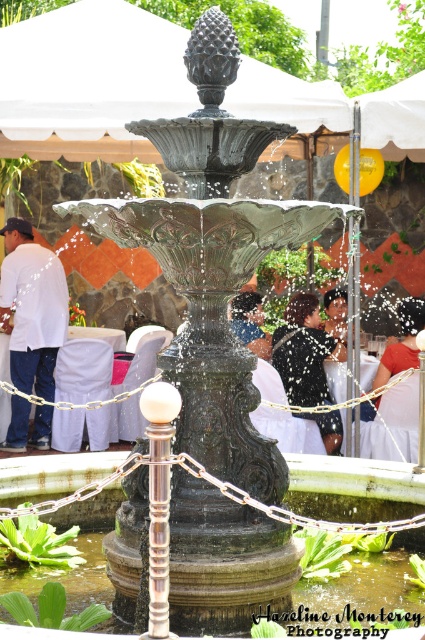
Is point (85, 22) farther from camera compared to point (28, 406)?

No.

Who is more distant from viewer, (153, 61) or (65, 332)?

Point (65, 332)

Find the location of `white fabric canopy at upper center`. white fabric canopy at upper center is located at coordinates (90, 81).

Does white matte shirt at center appear on the right side of dark blue dress at center?

No, white matte shirt at center is not to the right of dark blue dress at center.

Is point (39, 435) positioned after point (282, 346)?

Yes, point (39, 435) is behind point (282, 346).

Describe the element at coordinates (31, 307) in the screenshot. I see `white matte shirt at center` at that location.

I want to click on white matte shirt at center, so click(x=31, y=307).

Which is below, white fabric canopy at upper center or matte black dress at center?

Positioned lower is matte black dress at center.

From the picture: Is white fabric canopy at upper center smaller than matte black dress at center?

No, white fabric canopy at upper center is not smaller than matte black dress at center.

Locate an element on the screen. The height and width of the screenshot is (640, 425). white fabric canopy at upper center is located at coordinates (90, 81).